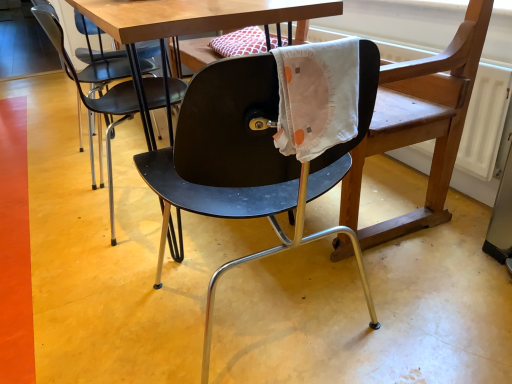
Question: Considering the positions of matte black chair at center, which appears as the 1th chair when viewed from the left, and matte black swivel chair at center in the image, is matte black chair at center, which appears as the 1th chair when viewed from the left, taller or shorter than matte black swivel chair at center?

Choices:
 (A) short
 (B) tall

Answer: (A)

Question: Is point (52, 13) closer or farther from the camera than point (459, 104)?

Choices:
 (A) closer
 (B) farther

Answer: (B)

Question: Estimate the real-world distances between objects in this image. Which object is closer to the matte black chair at center, acting as the second chair starting from the right?

Choices:
 (A) matte black chair at center, the second chair viewed from the left
 (B) matte black swivel chair at center

Answer: (A)

Question: Estimate the real-world distances between objects in this image. Which object is closer to the matte black swivel chair at center?

Choices:
 (A) matte black chair at center, acting as the second chair starting from the right
 (B) matte black chair at center, the second chair viewed from the left

Answer: (B)